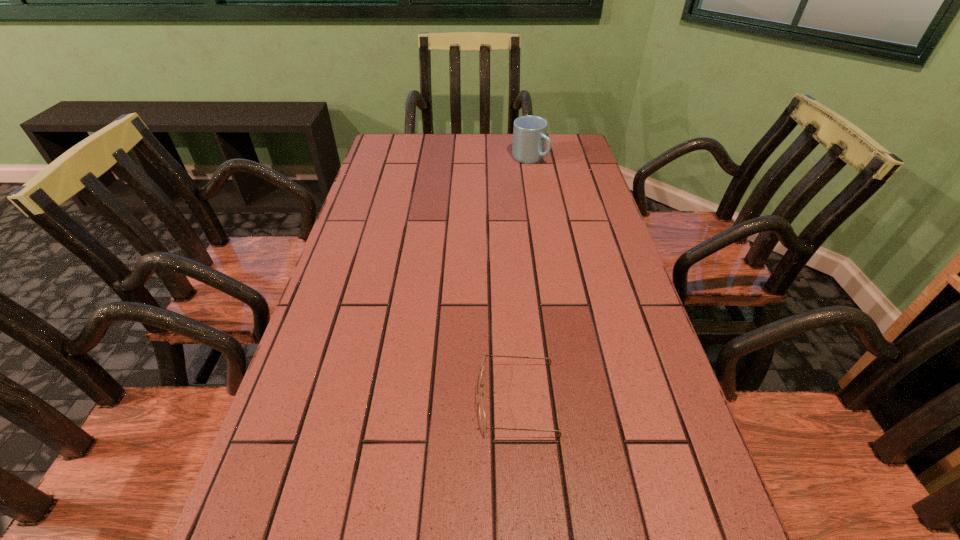
Locate an element on the screen. object that is positioned at the far right corner is located at coordinates (529, 132).

You are a GUI agent. You are given a task and a screenshot of the screen. Output one action in this format:
    pyautogui.click(x=<x>, y=<y>)
    Task: Click on the blank space at the far edge
    
    Given the screenshot: What is the action you would take?
    pyautogui.click(x=512, y=147)

Locate an element on the screen. free space at the left edge of the desktop is located at coordinates (389, 267).

Find the location of a particular element. free spot at the right edge of the desktop is located at coordinates (682, 481).

The height and width of the screenshot is (540, 960). I want to click on vacant space at the far left corner of the desktop, so click(377, 147).

This screenshot has width=960, height=540. In order to click on free area in between the spectacles and the taller object in this screenshot , I will do `click(523, 279)`.

Find the location of a particular element. The image size is (960, 540). free space between the mug and the nearer object is located at coordinates (523, 279).